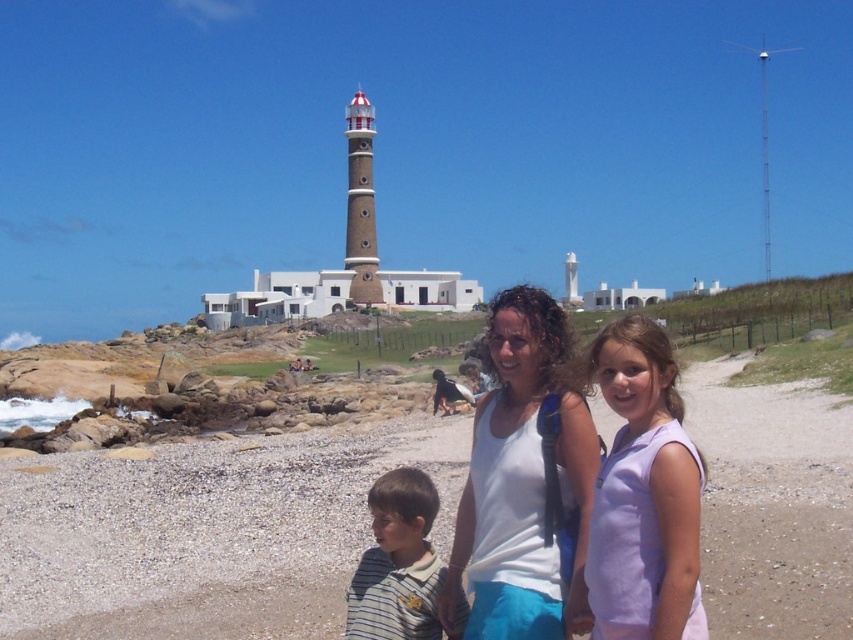
Can you confirm if smooth sand beach at lower center is wider than striped cotton shirt at lower left?

Correct, the width of smooth sand beach at lower center exceeds that of striped cotton shirt at lower left.

Can you confirm if smooth sand beach at lower center is shorter than striped cotton shirt at lower left?

In fact, smooth sand beach at lower center may be taller than striped cotton shirt at lower left.

This screenshot has width=853, height=640. What do you see at coordinates (204, 532) in the screenshot? I see `smooth sand beach at lower center` at bounding box center [204, 532].

What are the coordinates of `smooth sand beach at lower center` in the screenshot? It's located at (204, 532).

Does white matte tank top at center lie behind purple cotton shirt at center?

Yes, it is.

Based on the photo, does white matte tank top at center have a smaller size compared to purple cotton shirt at center?

No.

Does point (578, 486) come closer to viewer compared to point (659, 600)?

No.

Where is `white matte tank top at center`? white matte tank top at center is located at coordinates (524, 483).

Does white matte tank top at center come in front of striped cotton shirt at lower left?

Yes, it is in front of striped cotton shirt at lower left.

Is point (531, 524) less distant than point (364, 563)?

Yes, point (531, 524) is closer to viewer.

The image size is (853, 640). Identify the location of white matte tank top at center. (524, 483).